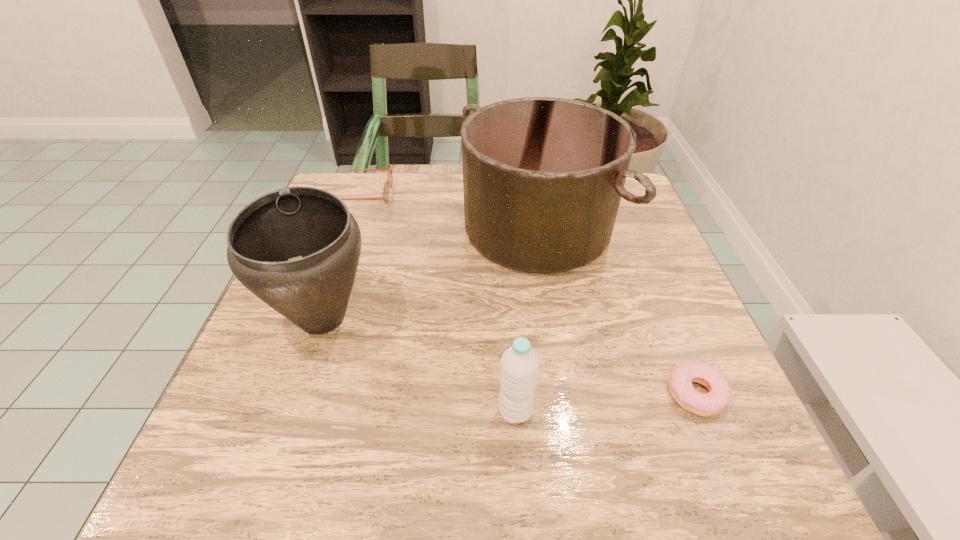
Find the location of a particular element. free point at the right edge is located at coordinates (661, 253).

Where is `free space at the far right corner of the desktop`? This screenshot has width=960, height=540. free space at the far right corner of the desktop is located at coordinates (624, 213).

Identify the location of free spot between the doughnut and the sunglasses. The width and height of the screenshot is (960, 540). (529, 294).

Identify the location of free space between the third tallest object and the urn. This screenshot has height=540, width=960. (419, 364).

Find the location of a particular element. The width and height of the screenshot is (960, 540). free point between the sunglasses and the pan is located at coordinates (450, 212).

Identify the location of vacant area that lies between the water bottle and the urn. (419, 364).

Locate an element on the screen. empty location between the water bottle and the doughnut is located at coordinates (606, 402).

Find the location of a particular element. empty space between the water bottle and the pan is located at coordinates (526, 320).

Where is `free space between the third shortest object and the sunglasses`? free space between the third shortest object and the sunglasses is located at coordinates (439, 303).

Where is `unoccupied area between the urn and the pan`? The width and height of the screenshot is (960, 540). unoccupied area between the urn and the pan is located at coordinates (430, 273).